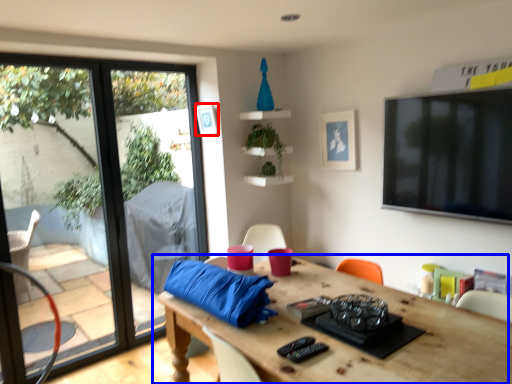
Question: Which object is further to the camera taking this photo, picture frame (highlighted by a red box) or table (highlighted by a blue box)?

Choices:
 (A) picture frame
 (B) table

Answer: (A)